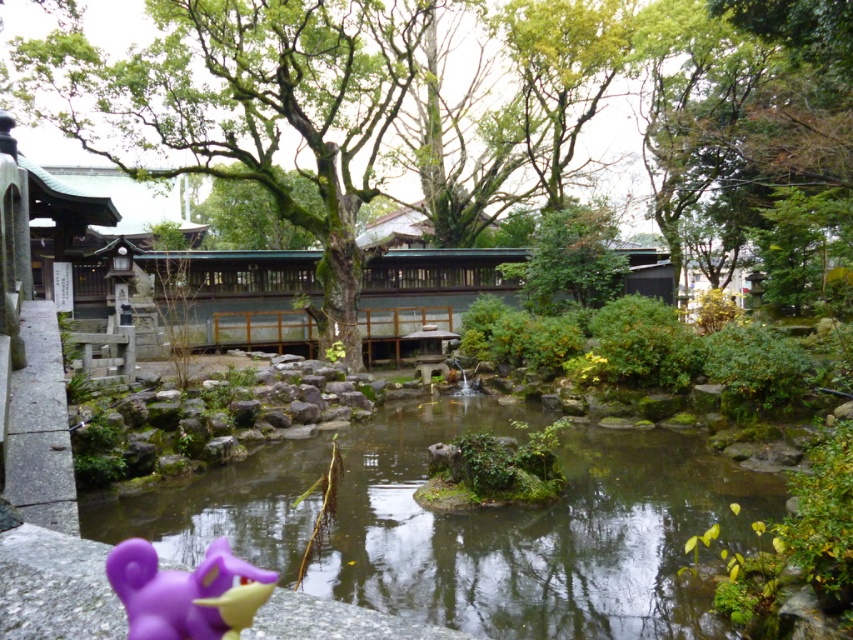
In the scene shown: You are standing at the entrance of the Japanese garden and see two points in the scene. The first point is labeled as point (457, 243) and the second is point (726, 532). Which point is closer to you?

Point (726, 532) is closer to you because point (457, 243) is behind it.

You are a visitor in the Japanese garden and want to find the purple matte toy at lower left. From your current position near the green mossy tree at center, which direction should you move to locate it?

The green mossy tree at center is positioned on the right side of the purple matte toy at lower left. Therefore, you should move to your left to locate the purple matte toy at lower left.

You are a visitor at the Japanese garden and want to place a new decorative item between the green mossy tree at center and the purple matte toy at lower left. Considering their sizes, which object should you position closer to the smaller one to maintain balance?

The purple matte toy at lower left is smaller in width compared to the green mossy tree at center. To maintain balance, position the new decorative item closer to the purple matte toy at lower left.